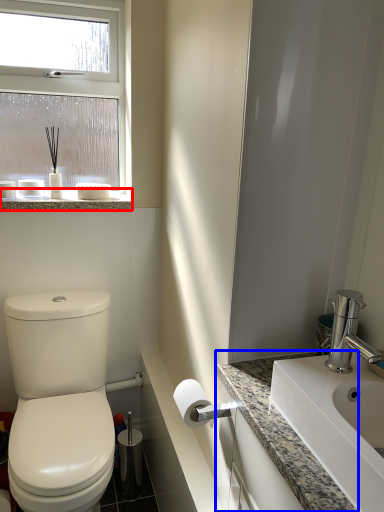
Question: Which object appears farthest to the camera in this image, window sill (highlighted by a red box) or counter top (highlighted by a blue box)?

Choices:
 (A) window sill
 (B) counter top

Answer: (A)